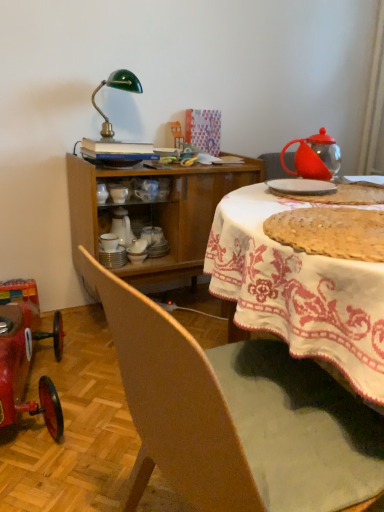
What do you see at coordinates (315, 157) in the screenshot?
I see `transparent glass teapot at upper right` at bounding box center [315, 157].

The image size is (384, 512). Describe the element at coordinates (155, 213) in the screenshot. I see `wooden cabinet at center` at that location.

Find the location of `porcelain cup at center, the second tableware when ordered from right to left`. porcelain cup at center, the second tableware when ordered from right to left is located at coordinates (146, 189).

What do you see at coordinates (235, 417) in the screenshot? I see `wooden chair at lower left` at bounding box center [235, 417].

The image size is (384, 512). Find the location of `transparent glass teapot at upper right`. transparent glass teapot at upper right is located at coordinates (315, 157).

Choose the correct answer: Is porcelain cup at center, which is the 3th tableware in back-to-front order, inside wooden chair at lower left or outside it?

porcelain cup at center, which is the 3th tableware in back-to-front order, is spatially situated outside wooden chair at lower left.

From the picture: From the image's perspective, does porcelain cup at center, which is the 3th tableware in back-to-front order, appear lower than wooden chair at lower left?

No, from the image's perspective, porcelain cup at center, which is the 3th tableware in back-to-front order, is not beneath wooden chair at lower left.

Considering their positions, is porcelain cup at center, the second tableware when ordered from right to left, located in front of or behind wooden chair at lower left?

Visually, porcelain cup at center, the second tableware when ordered from right to left, is located behind wooden chair at lower left.

From the image's perspective, is white ceramic plate at upper center, arranged as the 4th tableware when viewed from the back, on top of white ceramic plates at center, placed as the 3th tableware when sorted from front to back?

Correct, white ceramic plate at upper center, arranged as the 4th tableware when viewed from the back, appears higher than white ceramic plates at center, placed as the 3th tableware when sorted from front to back, in the image.

From their relative heights in the image, would you say white ceramic plate at upper center, placed as the fourth tableware when sorted from left to right, is taller or shorter than white ceramic plates at center, placed as the 3th tableware when sorted from front to back?

white ceramic plate at upper center, placed as the fourth tableware when sorted from left to right, is shorter than white ceramic plates at center, placed as the 3th tableware when sorted from front to back.

Looking at this image, does white ceramic plate at upper center, arranged as the 4th tableware when viewed from the back, appear on the left side of white ceramic plates at center, the 1th tableware viewed from the left?

In fact, white ceramic plate at upper center, arranged as the 4th tableware when viewed from the back, is to the right of white ceramic plates at center, the 1th tableware viewed from the left.

Measure the distance between white ceramic plate at upper center, acting as the first tableware starting from the front, and white ceramic plates at center, placed as the 3th tableware when sorted from front to back.

white ceramic plate at upper center, acting as the first tableware starting from the front, is 88.25 centimeters from white ceramic plates at center, placed as the 3th tableware when sorted from front to back.

Which of these two, wooden cabinet at center or white ceramic plate at upper center, the 1th tableware when ordered from right to left, stands taller?

Standing taller between the two is wooden cabinet at center.

Considering the relative sizes of wooden cabinet at center and white ceramic plate at upper center, arranged as the 4th tableware when viewed from the back, in the image provided, is wooden cabinet at center bigger than white ceramic plate at upper center, arranged as the 4th tableware when viewed from the back,?

Yes.

From the image's perspective, is wooden cabinet at center beneath white ceramic plate at upper center, the 1th tableware when ordered from right to left?

Indeed, from the image's perspective, wooden cabinet at center is shown beneath white ceramic plate at upper center, the 1th tableware when ordered from right to left.

Considering the relative positions of wooden cabinet at center and white ceramic plate at upper center, arranged as the 4th tableware when viewed from the back, in the image provided, is wooden cabinet at center to the left or to the right of white ceramic plate at upper center, arranged as the 4th tableware when viewed from the back,?

In the image, wooden cabinet at center appears on the right side of white ceramic plate at upper center, arranged as the 4th tableware when viewed from the back.

How different are the orientations of white ceramic plate at upper center, placed as the fourth tableware when sorted from left to right, and wooden cabinet at center in degrees?

12.2 degrees.

From a real-world perspective, which object stands above the other?

From a 3D spatial view, white ceramic plate at upper center, the 1th tableware when ordered from right to left, is above.

From the image's perspective, which is below, white ceramic plate at upper center, acting as the first tableware starting from the front, or wooden cabinet at center?

From the image's view, wooden cabinet at center is below.

Based on the photo, considering the sizes of white ceramic plate at upper center, arranged as the 4th tableware when viewed from the back, and wooden cabinet at center in the image, is white ceramic plate at upper center, arranged as the 4th tableware when viewed from the back, bigger or smaller than wooden cabinet at center?

Considering their sizes, white ceramic plate at upper center, arranged as the 4th tableware when viewed from the back, takes up less space than wooden cabinet at center.

Between white ceramic plates at center, the 1th tableware viewed from the left, and transparent glass teapot at upper right, which one has larger size?

Bigger between the two is transparent glass teapot at upper right.

Is white ceramic plates at center, the 1th tableware viewed from the left, positioned far away from transparent glass teapot at upper right?

No, there isn't a large distance between white ceramic plates at center, the 1th tableware viewed from the left, and transparent glass teapot at upper right.

Considering the sizes of white ceramic plates at center, the 1th tableware viewed from the left, and transparent glass teapot at upper right in the image, is white ceramic plates at center, the 1th tableware viewed from the left, wider or thinner than transparent glass teapot at upper right?

Clearly, white ceramic plates at center, the 1th tableware viewed from the left, has less width compared to transparent glass teapot at upper right.

Considering the relative positions of white ceramic plates at center, the fourth tableware viewed from the right, and transparent glass teapot at upper right in the image provided, is white ceramic plates at center, the fourth tableware viewed from the right, to the right of transparent glass teapot at upper right from the viewer's perspective?

No, white ceramic plates at center, the fourth tableware viewed from the right, is not to the right of transparent glass teapot at upper right.

Is porcelain cup at center, which is the 3th tableware in back-to-front order, in contact with green glass lamp at upper left?

No, porcelain cup at center, which is the 3th tableware in back-to-front order, is not with green glass lamp at upper left.

Based on the photo, in terms of width, does porcelain cup at center, which is the 3th tableware in back-to-front order, look wider or thinner when compared to green glass lamp at upper left?

In the image, porcelain cup at center, which is the 3th tableware in back-to-front order, appears to be more narrow than green glass lamp at upper left.

Considering their positions, is porcelain cup at center, placed as the third tableware when sorted from left to right, located in front of or behind green glass lamp at upper left?

Clearly, porcelain cup at center, placed as the third tableware when sorted from left to right, is behind green glass lamp at upper left.

Between porcelain cup at center, placed as the third tableware when sorted from left to right, and green glass lamp at upper left, which one has more height?

green glass lamp at upper left.

Looking at their sizes, would you say white ceramic plate at upper center, arranged as the 4th tableware when viewed from the back, is wider or thinner than wooden cabinet at center?

Considering their sizes, white ceramic plate at upper center, arranged as the 4th tableware when viewed from the back, looks slimmer than wooden cabinet at center.

Is white ceramic plate at upper center, arranged as the 4th tableware when viewed from the back, to the left of wooden cabinet at center from the viewer's perspective?

No, white ceramic plate at upper center, arranged as the 4th tableware when viewed from the back, is not to the left of wooden cabinet at center.

How different are the orientations of white ceramic plate at upper center, placed as the fourth tableware when sorted from left to right, and wooden cabinet at center in degrees?

The angle between the facing direction of white ceramic plate at upper center, placed as the fourth tableware when sorted from left to right, and the facing direction of wooden cabinet at center is 76.6 degrees.

Starting from the wooden chair at lower left, which tableware is the 2nd one behind? Please provide its 2D coordinates.

[(146, 189)]

There is a white ceramic plate at upper center, arranged as the 4th tableware when viewed from the back. At what (x,y) coordinates should I click in order to perform the action: click on the 2nd tableware below it (from the image's perspective). Please return your answer as a coordinate pair (x, y). This screenshot has width=384, height=512. Looking at the image, I should click on (112, 257).

From the image, which object appears to be farther from wooden cabinet at center, shiny red toy car at lower left or wooden chair at lower left?

shiny red toy car at lower left is positioned further to the anchor wooden cabinet at center.

Considering their positions, is white ceramic plates at center, the fourth tableware viewed from the right, positioned further to wooden chair at lower left than porcelain cup at center, placed as the third tableware when sorted from left to right?

The object further to wooden chair at lower left is porcelain cup at center, placed as the third tableware when sorted from left to right.

Estimate the real-world distances between objects in this image. Which object is closer to white ceramic plate at upper center, the 1th tableware when ordered from right to left, wooden cabinet at center or wooden cabinet at center?

wooden cabinet at center.

Estimate the real-world distances between objects in this image. Which object is closer to wooden chair at lower left, wooden cabinet at center or golden crumbly pie at center?

golden crumbly pie at center is positioned closer to the anchor wooden chair at lower left.

Based on their spatial positions, is white ceramic plate at upper center, the 1th tableware when ordered from right to left, or golden crumbly pie at center closer to transparent glass teapot at upper right?

white ceramic plate at upper center, the 1th tableware when ordered from right to left, is positioned closer to the anchor transparent glass teapot at upper right.

Estimate the real-world distances between objects in this image. Which object is closer to white ceramic plate at upper center, the 1th tableware when ordered from right to left, porcelain cup at center, which is the 3th tableware in back-to-front order, or white glossy bowls at center, which ranks as the 3th tableware in right-to-left order?

The object closer to white ceramic plate at upper center, the 1th tableware when ordered from right to left, is porcelain cup at center, which is the 3th tableware in back-to-front order.

Considering their positions, is wooden chair at lower left positioned further to wooden cabinet at center than golden crumbly pie at center?

wooden chair at lower left lies further to wooden cabinet at center than the other object.

Based on their spatial positions, is shiny red toy car at lower left or transparent glass teapot at upper right further from wooden chair at lower left?

The object further to wooden chair at lower left is shiny red toy car at lower left.

At what (x,y) coordinates should I click in order to perform the action: click on tableware between wooden cabinet at center and transparent glass teapot at upper right in the front-back direction. Please return your answer as a coordinate pair (x, y). Looking at the image, I should click on (301, 186).

Identify the location of tableware between wooden chair at lower left and wooden cabinet at center in the front-back direction. This screenshot has height=512, width=384. (301, 186).

Locate an element on the screen. The height and width of the screenshot is (512, 384). food between shiny red toy car at lower left and transparent glass teapot at upper right in the horizontal direction is located at coordinates (330, 232).

Identify the location of desk between wooden chair at lower left and white ceramic plates at center, the fourth tableware viewed from the right, along the z-axis. This screenshot has height=512, width=384. (299, 292).